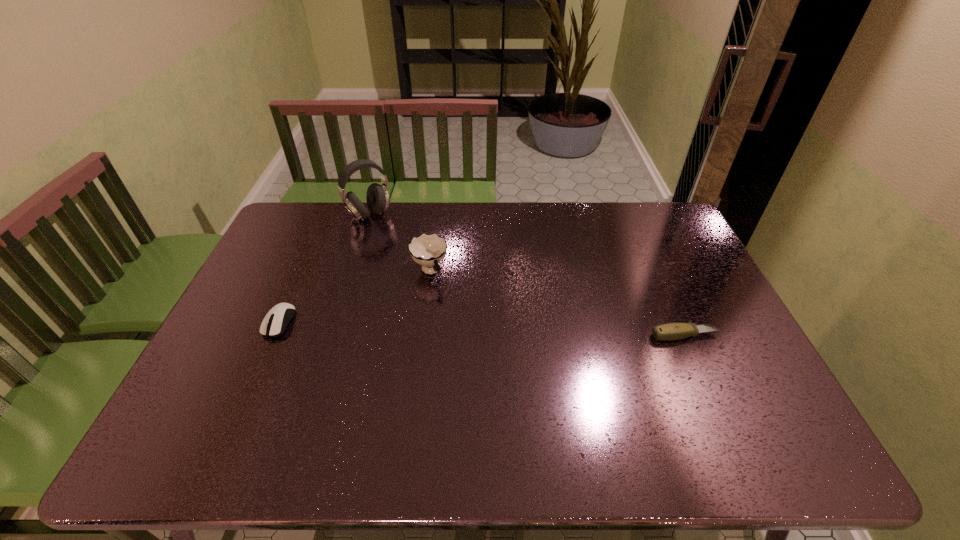
Where is `vacant area that lies between the third shortest object and the pocketknife`? vacant area that lies between the third shortest object and the pocketknife is located at coordinates pyautogui.click(x=558, y=303).

Image resolution: width=960 pixels, height=540 pixels. Identify the location of vacant space that's between the pocketknife and the second tallest object. (558, 303).

At what (x,y) coordinates should I click in order to perform the action: click on free space between the tallest object and the third tallest object. Please return your answer as a coordinate pair (x, y). Looking at the image, I should click on (324, 268).

At what (x,y) coordinates should I click in order to perform the action: click on free space that is in between the third tallest object and the rightmost object. Please return your answer as a coordinate pair (x, y). Image resolution: width=960 pixels, height=540 pixels. Looking at the image, I should click on (482, 329).

Locate which object is the third closest to the cup. Please provide its 2D coordinates. Your answer should be formatted as a tuple, i.e. [(x, y)], where the tuple contains the x and y coordinates of a point satisfying the conditions above.

[(671, 331)]

Choose which object is the nearest neighbor to the third tallest object. Please provide its 2D coordinates. Your answer should be formatted as a tuple, i.e. [(x, y)], where the tuple contains the x and y coordinates of a point satisfying the conditions above.

[(426, 250)]

Find the location of a particular element. The image size is (960, 540). free location that satisfies the following two spatial constraints: 1. on the front side of the second object from right to left; 2. on the right side of the shortest object is located at coordinates (422, 335).

The height and width of the screenshot is (540, 960). I want to click on free location that satisfies the following two spatial constraints: 1. on the front side of the pocketknife; 2. on the right side of the cup, so click(x=422, y=335).